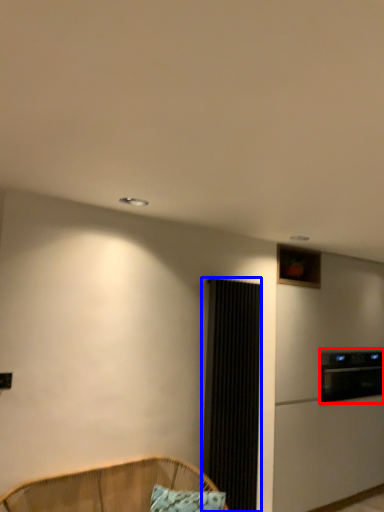
Question: Among these objects, which one is nearest to the camera, appliance (highlighted by a red box) or screen door (highlighted by a blue box)?

Choices:
 (A) appliance
 (B) screen door

Answer: (B)